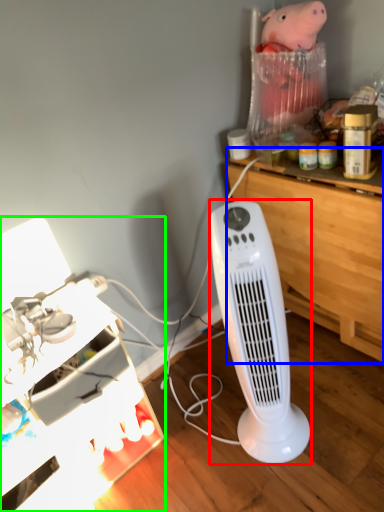
Question: Which object is the closest to the home appliance (highlighted by a red box)? Choose among these: computer desk (highlighted by a blue box) or furniture (highlighted by a green box).

Choices:
 (A) computer desk
 (B) furniture

Answer: (A)